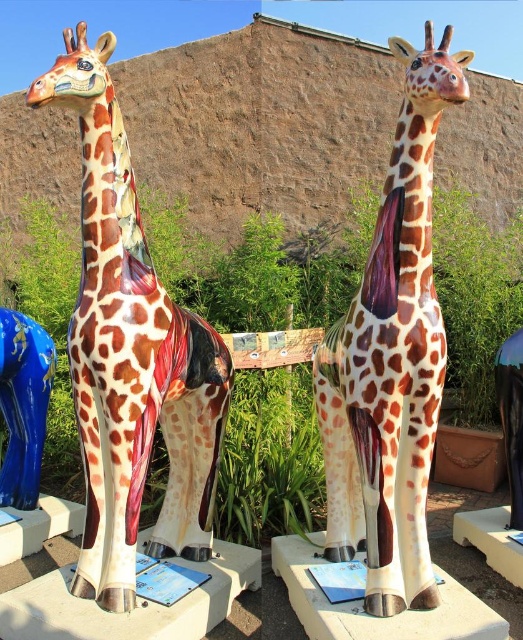
From the picture: You are a visitor standing in front of the two ceramic giraffe sculptures. You want to take a photo of the glossy ceramic giraffe at center without the polished ceramic giraffe at left blocking the view. Is it possible to do so?

The polished ceramic giraffe at left is further to the viewer than glossy ceramic giraffe at center. Therefore, it is blocking the view of the glossy ceramic giraffe at center. To take a photo of the glossy ceramic giraffe at center without obstruction, you would need to move around the polished ceramic giraffe at left to find an angle where it is no longer in front.

You are a delivery person trying to move a large box from the blue glossy vase at lower left to the glossy ceramic giraffe at center. The path between them is narrow. Can you pass through without tilting the box? Please explain your reasoning based on their widths.

The glossy ceramic giraffe at center might be wider than the blue glossy vase at lower left. If the path is narrow and the giraffe is wider, the box might not fit through. However, since the exact width difference isn t specified, it s uncertain. Proceed with caution.

Looking at this image, you are a tour guide leading a group of visitors to a sculpture garden. You need to ensure that the path between the polished ceramic giraffe at left and the glossy ceramic giraffe at center is wide enough for a wheelchair to pass through. The wheelchair requires a minimum of 36 inches of clearance. Can the wheelchair navigate between them?

The polished ceramic giraffe at left and glossy ceramic giraffe at center are 30.79 inches apart from each other. Since the required clearance for the wheelchair is 36 inches, the distance is insufficient, so the wheelchair cannot navigate between them.